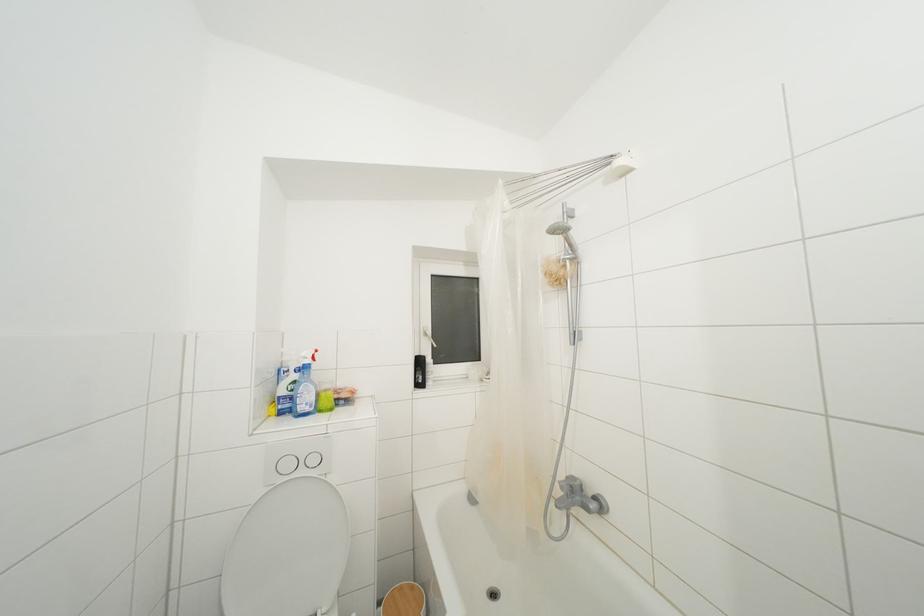
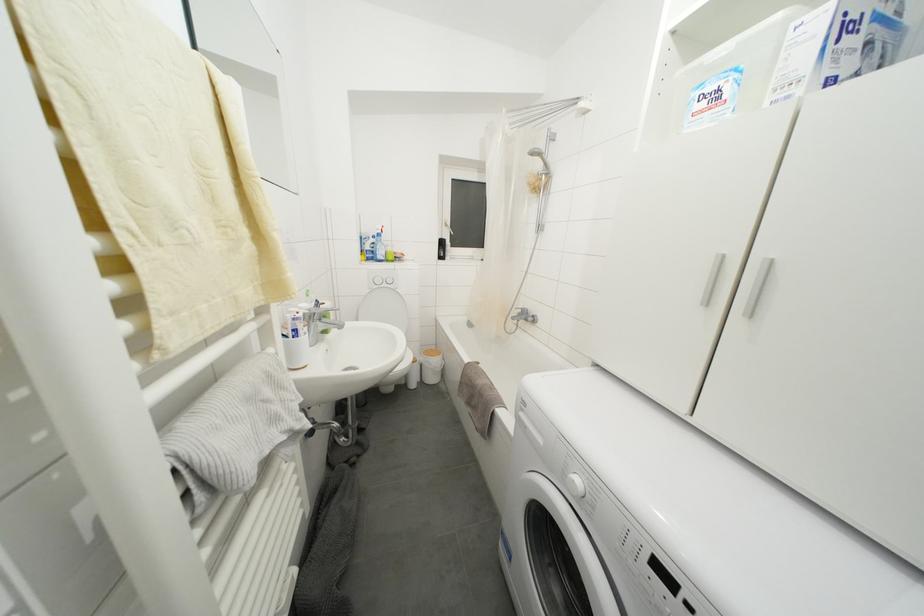
Question: Based on the continuous images, in which direction is the camera rotating? Reply with the corresponding letter.

Choices:
 (A) Left
 (B) Right
 (C) Up
 (D) Down

Answer: (D)